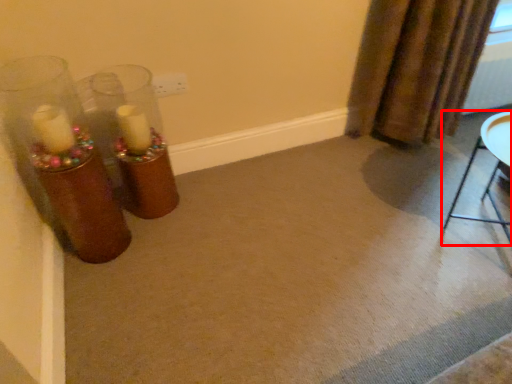
Question: From the image, what is the correct spatial relationship of furniture (annotated by the red box) in relation to curtain?

Choices:
 (A) right
 (B) left

Answer: (A)